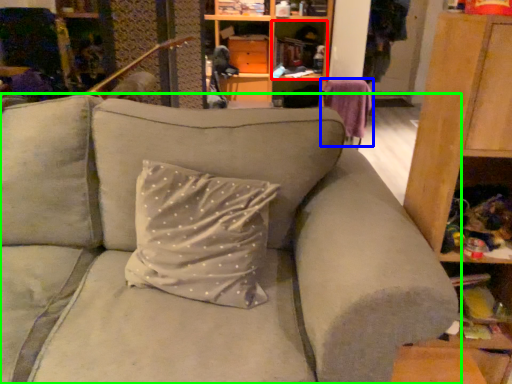
Question: Which is nearer to the cabinet (highlighted by a red box)? swivel chair (highlighted by a blue box) or studio couch (highlighted by a green box).

Choices:
 (A) swivel chair
 (B) studio couch

Answer: (A)